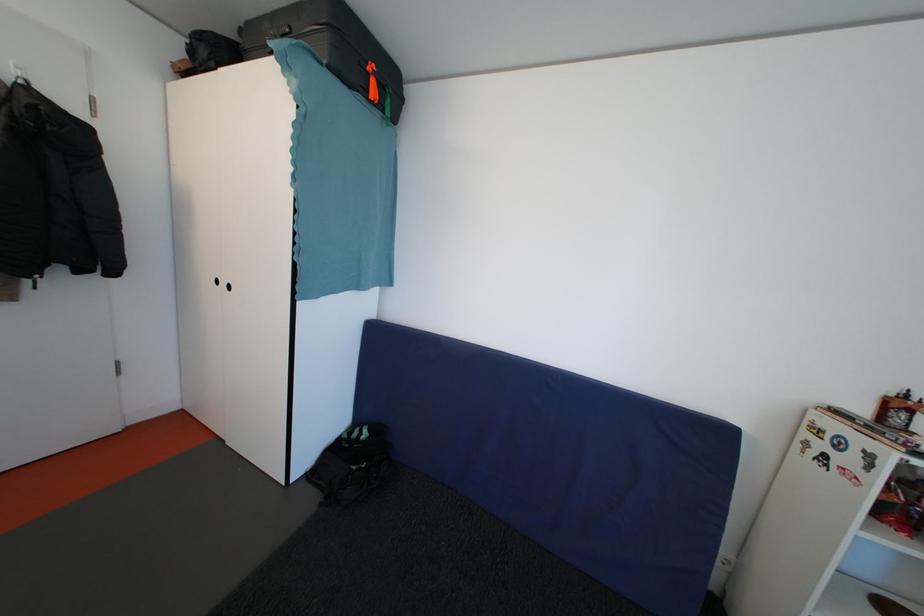
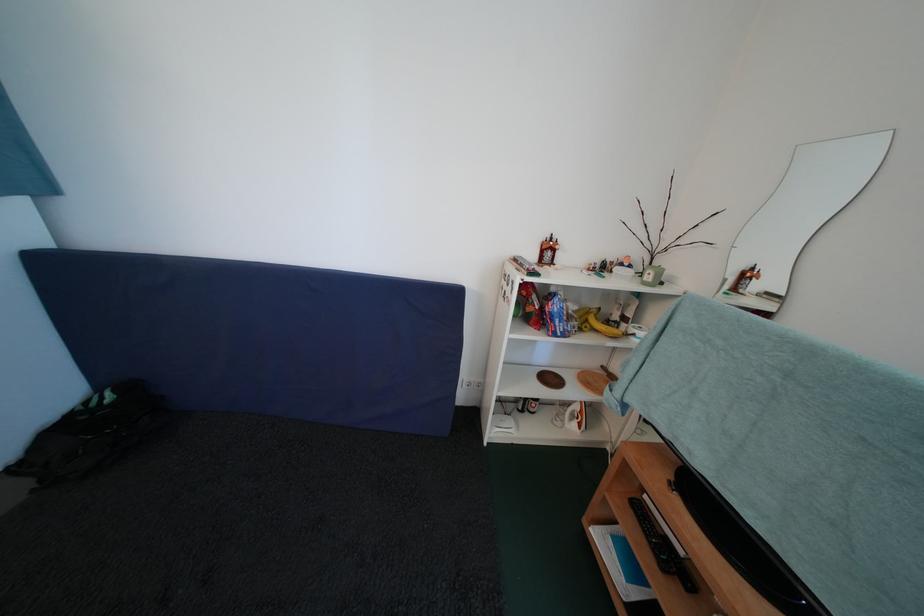
Find the pixel in the second image that matches [868,416] in the first image.

(539, 261)